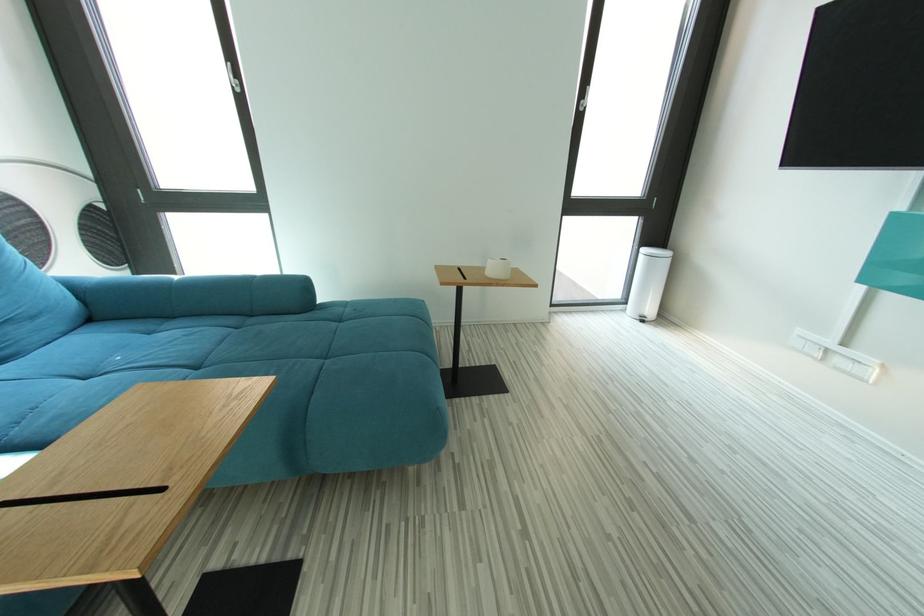
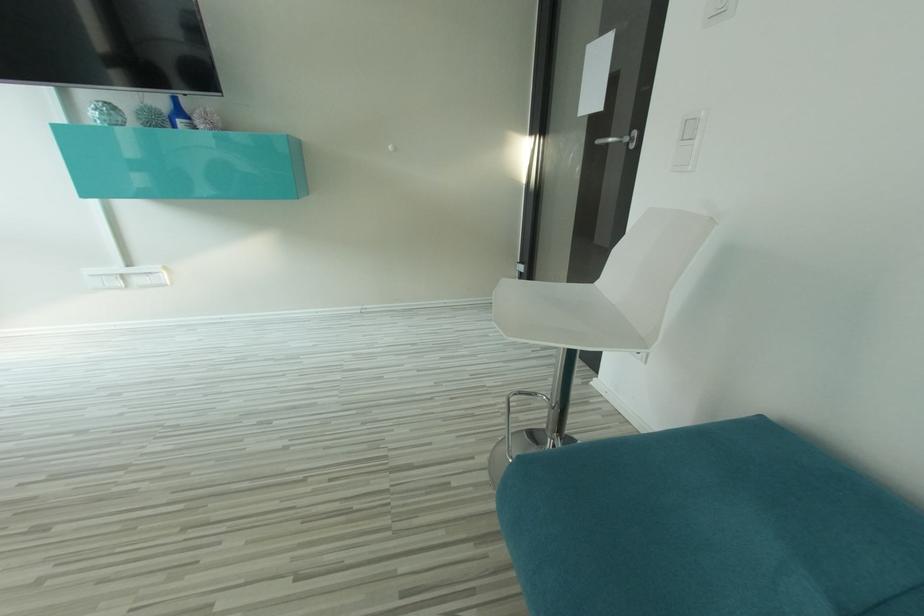
First-person continuous shooting, in which direction is the camera rotating?

The rotation direction of the camera is right-down.